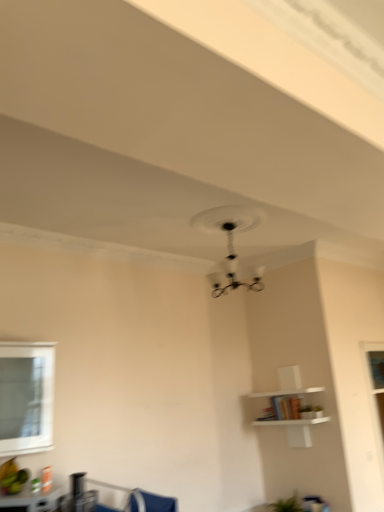
Question: Is clear glass window at lower left located within white matte shelf at upper right?

Choices:
 (A) no
 (B) yes

Answer: (A)

Question: Is white matte shelf at upper right touching clear glass window at lower left?

Choices:
 (A) no
 (B) yes

Answer: (A)

Question: From a real-world perspective, is white matte shelf at upper right on clear glass window at lower left?

Choices:
 (A) yes
 (B) no

Answer: (B)

Question: Can you confirm if white matte shelf at upper right is positioned to the right of clear glass window at lower left?

Choices:
 (A) yes
 (B) no

Answer: (A)

Question: Is the depth of white matte shelf at upper right greater than that of clear glass window at lower left?

Choices:
 (A) yes
 (B) no

Answer: (A)

Question: From the image's perspective, is white matte shelf at upper right beneath clear glass window at lower left?

Choices:
 (A) yes
 (B) no

Answer: (A)

Question: Is clear glass window at lower left positioned beyond the bounds of matte black table at lower left?

Choices:
 (A) yes
 (B) no

Answer: (A)

Question: Can you confirm if clear glass window at lower left is positioned to the right of matte black table at lower left?

Choices:
 (A) no
 (B) yes

Answer: (A)

Question: Does clear glass window at lower left contain matte black table at lower left?

Choices:
 (A) no
 (B) yes

Answer: (A)

Question: From the image's perspective, would you say clear glass window at lower left is shown under matte black table at lower left?

Choices:
 (A) no
 (B) yes

Answer: (A)

Question: Does clear glass window at lower left have a greater height compared to matte black table at lower left?

Choices:
 (A) no
 (B) yes

Answer: (B)

Question: Could you tell me if clear glass window at lower left is facing matte black table at lower left?

Choices:
 (A) yes
 (B) no

Answer: (B)

Question: Is matte black table at lower left positioned with its back to blue fabric swivel chair at lower center?

Choices:
 (A) yes
 (B) no

Answer: (B)